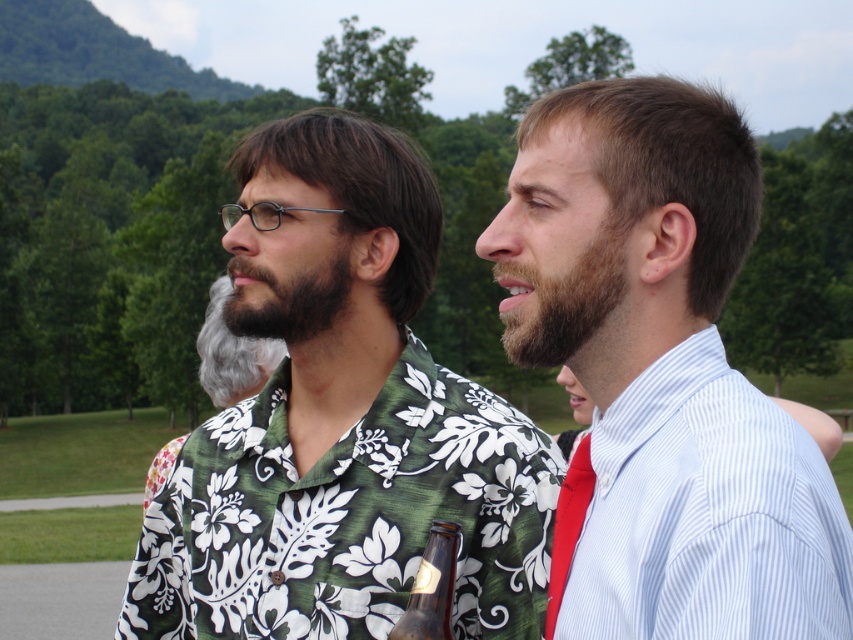
Question: Among these objects, which one is nearest to the camera?

Choices:
 (A) dark brown fuzzy beard at center
 (B) red satin tie at right
 (C) gray beard at center

Answer: (B)

Question: Can you confirm if green floral shirt at center is smaller than red satin tie at right?

Choices:
 (A) yes
 (B) no

Answer: (B)

Question: Which object is farther from the camera taking this photo?

Choices:
 (A) brown glass bottle at center
 (B) gray beard at center

Answer: (B)

Question: Based on their relative distances, which object is nearer to the red satin tie at right?

Choices:
 (A) brown fuzzy beard at center
 (B) dark brown fuzzy beard at center
 (C) white striped dress shirt at right

Answer: (C)

Question: Does light blue striped shirt at center appear on the left side of red satin tie at right?

Choices:
 (A) yes
 (B) no

Answer: (A)

Question: Does green floral shirt at center have a lesser width compared to light blue striped shirt at center?

Choices:
 (A) no
 (B) yes

Answer: (A)